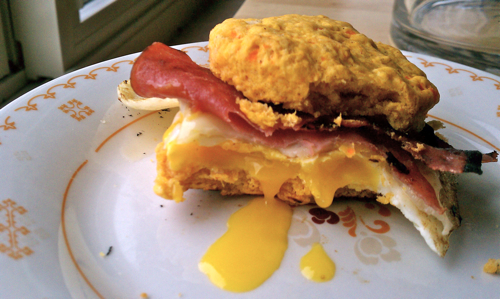
Locate an element on the screen. The height and width of the screenshot is (299, 500). table is located at coordinates (377, 13).